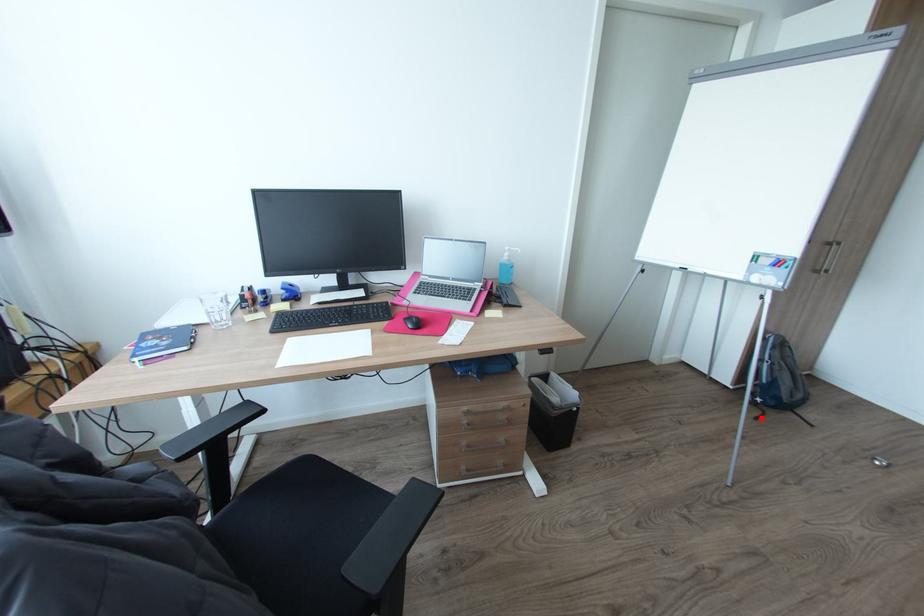
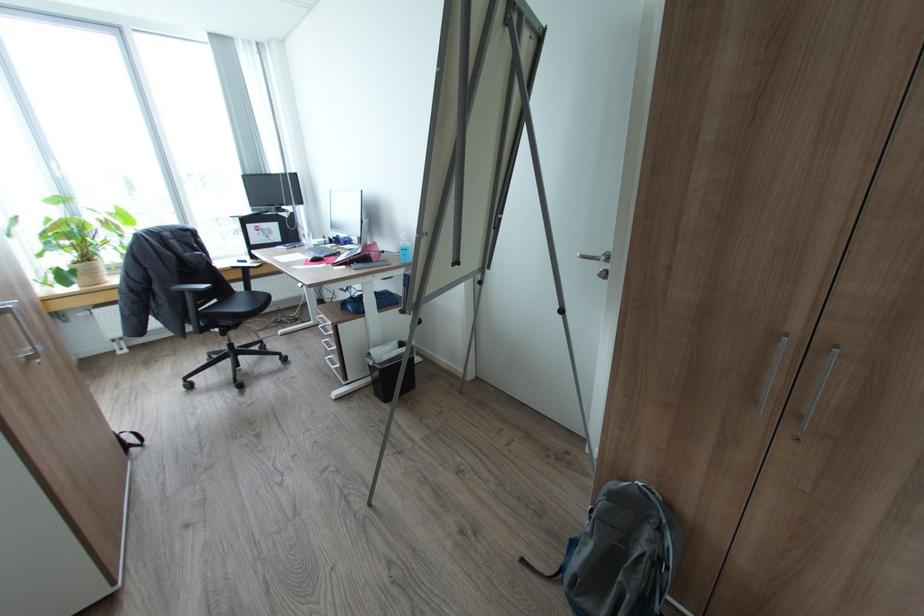
Where in the second image is the point corresponding to the highlighted location from the first image?

(527, 560)